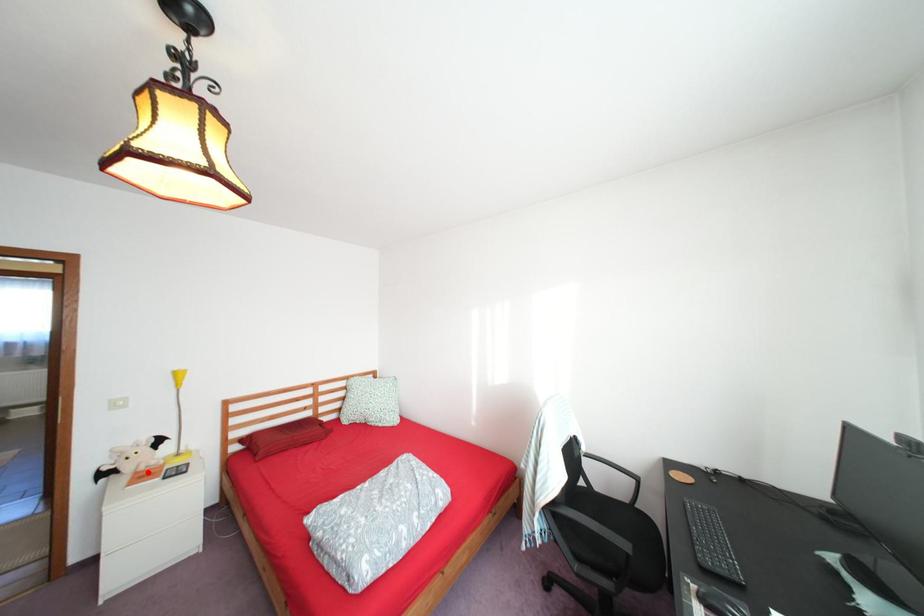
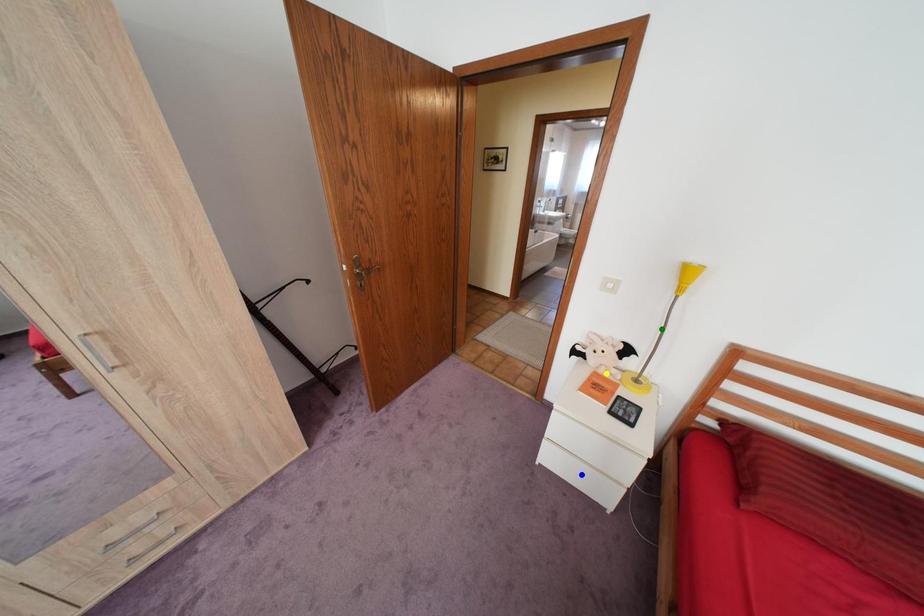
Question: I am providing you with two images of the same scene from different viewpoints. A red point is marked on the first image. You are given multiple points on the second image. Which point in image 2 represents the same 3d spot as the red point in image 1?

Choices:
 (A) green point
 (B) blue point
 (C) yellow point

Answer: (C)